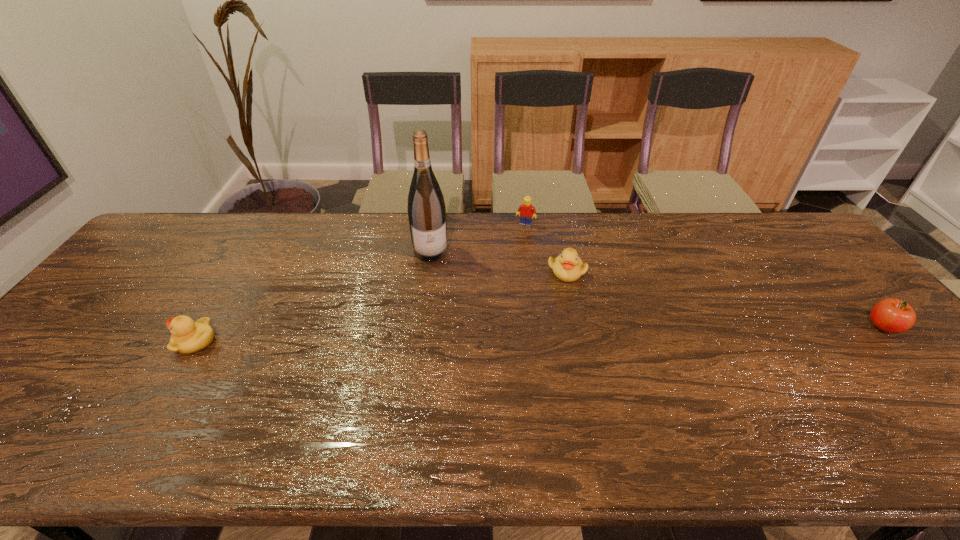
Locate an element on the screen. free space on the desktop that is between the nearer duckling and the apple and is positioned on the label of the wine bottle is located at coordinates (446, 336).

Locate an element on the screen. Image resolution: width=960 pixels, height=540 pixels. vacant space on the desktop that is between the nearer duckling and the apple and is positioned on the beak of the fourth object from left to right is located at coordinates (472, 335).

Locate an element on the screen. This screenshot has height=540, width=960. vacant space on the desktop that is between the leftmost object and the apple and is positioned on the front-facing side of the Lego is located at coordinates (486, 335).